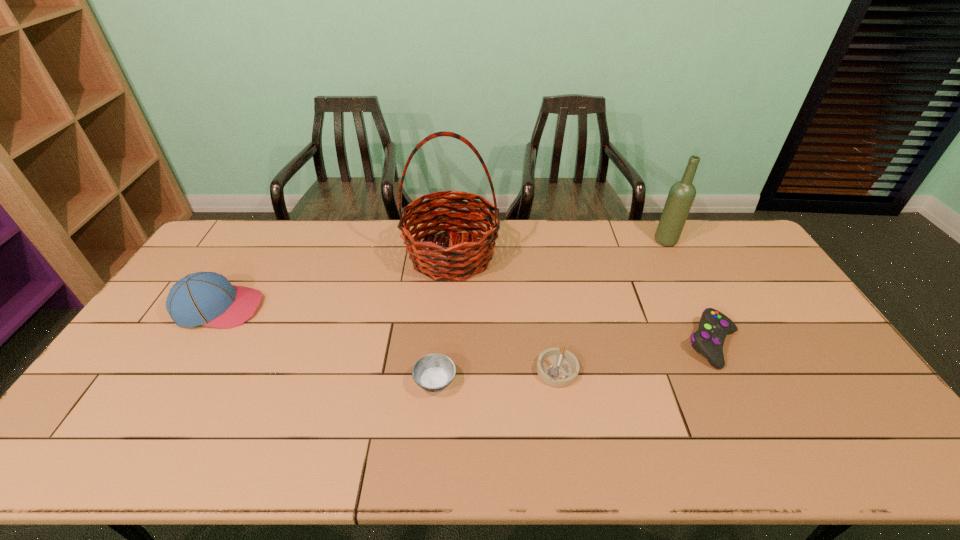
Image resolution: width=960 pixels, height=540 pixels. I want to click on the tallest object, so pos(464,258).

This screenshot has width=960, height=540. I want to click on wine bottle, so click(682, 194).

Where is `the third tallest object`? the third tallest object is located at coordinates (203, 298).

The width and height of the screenshot is (960, 540). Find the location of `the leftmost object`. the leftmost object is located at coordinates (203, 298).

Where is `control`? The image size is (960, 540). control is located at coordinates (708, 340).

This screenshot has height=540, width=960. I want to click on the taller ashtray, so click(x=434, y=372).

Where is `the left ashtray`? the left ashtray is located at coordinates (434, 372).

The width and height of the screenshot is (960, 540). Identify the location of the right ashtray. (556, 367).

Where is `the shorter ashtray`? the shorter ashtray is located at coordinates (556, 367).

Identify the location of free space located 0.090m on the handle side of the tallest object. (447, 309).